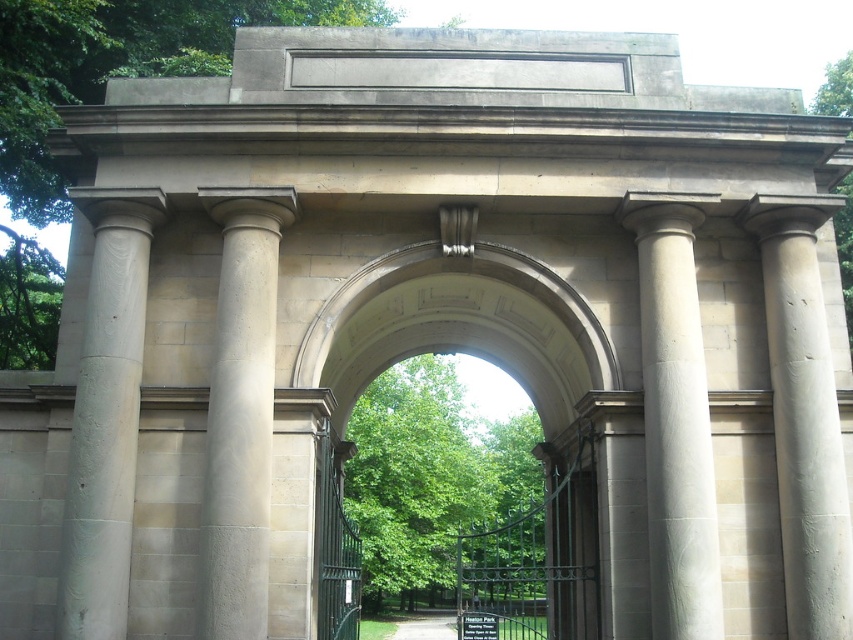
Question: Which of the following is the closest to the observer?

Choices:
 (A) (699, 333)
 (B) (840, 108)
 (C) (228, 636)

Answer: (C)

Question: Can you confirm if white stone column at left is positioned above smooth stone column at right?

Choices:
 (A) yes
 (B) no

Answer: (B)

Question: Can you confirm if white stone column at left is positioned to the left of white marble column at center?

Choices:
 (A) no
 (B) yes

Answer: (B)

Question: Which point is farther to the camera?

Choices:
 (A) (224, 476)
 (B) (106, 337)
 (C) (448, 627)

Answer: (C)

Question: Where is smooth stone column at left located in relation to green leafy tree at right in the image?

Choices:
 (A) left
 (B) right

Answer: (A)

Question: Estimate the real-world distances between objects in this image. Which object is farther from the green leafy tree at center?

Choices:
 (A) green leafy tree at left
 (B) green wrought iron gate at center
 (C) green grass at center

Answer: (A)